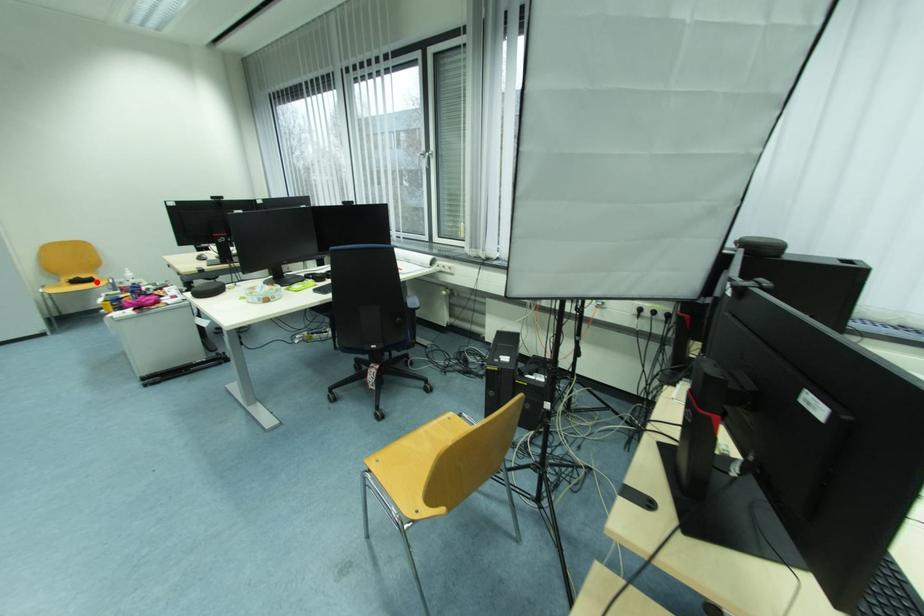
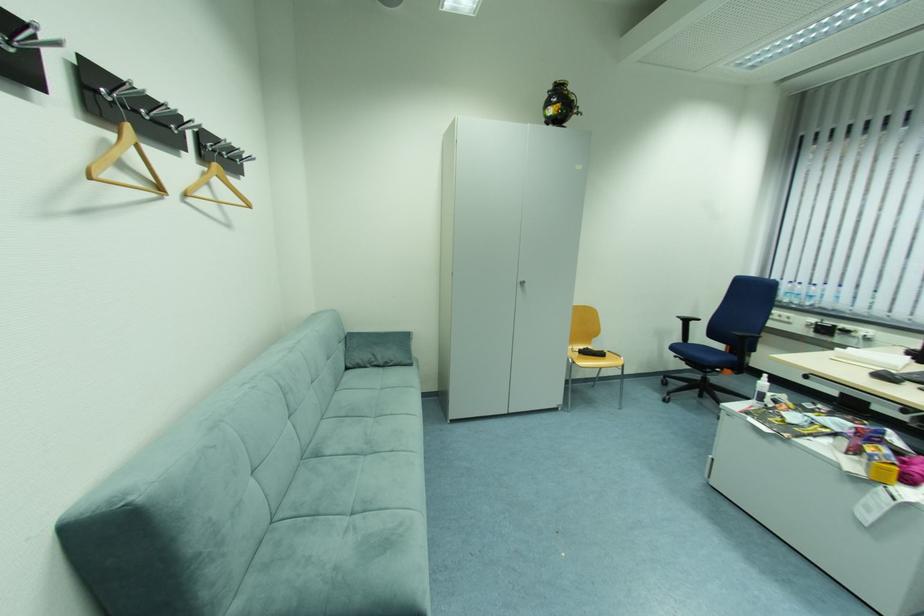
Find the pixel in the second image that matches the highlighted location in the first image.

(608, 355)